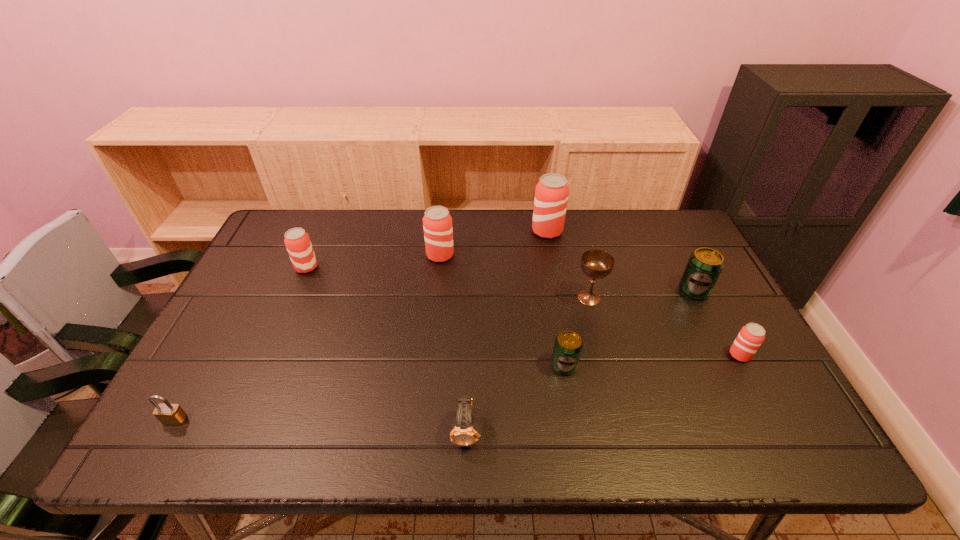
Locate an element on the screen. vacant region located 0.360m on the front of the bigger green beer can is located at coordinates (756, 416).

Identify the location of free space located on the right of the nearer green beer can. (723, 366).

Identify the location of vacant space located on the back of the smallest orange beer can. The width and height of the screenshot is (960, 540). (699, 278).

What are the coordinates of `vacant space situated 0.210m on the right of the padlock` in the screenshot? It's located at (280, 420).

Locate an element on the screen. The width and height of the screenshot is (960, 540). padlock that is positioned at the near edge is located at coordinates (168, 414).

Where is `watch at the near edge`? watch at the near edge is located at coordinates (463, 434).

Locate an element on the screen. The width and height of the screenshot is (960, 540). beer can that is at the left edge is located at coordinates (297, 241).

Where is `padlock that is positioned at the left edge`? The image size is (960, 540). padlock that is positioned at the left edge is located at coordinates (168, 414).

The height and width of the screenshot is (540, 960). Find the location of `object that is at the near left corner`. object that is at the near left corner is located at coordinates (168, 414).

In the image, there is a desktop. Identify the location of free space at the far edge. (372, 242).